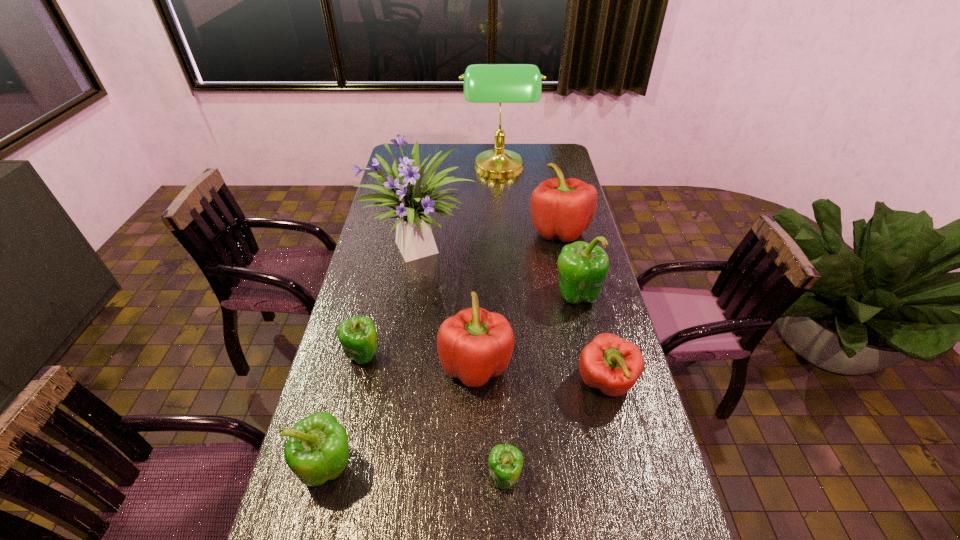
Select which bell pepper appears as the third closest to the second biggest pink bell pepper. Please provide its 2D coordinates. Your answer should be formatted as a tuple, i.e. [(x, y)], where the tuple contains the x and y coordinates of a point satisfying the conditions above.

[(583, 268)]

This screenshot has width=960, height=540. I want to click on the closest green bell pepper to the second smallest green bell pepper, so click(317, 450).

Identify which green bell pepper is the closest to the biggest green bell pepper. Please provide its 2D coordinates. Your answer should be formatted as a tuple, i.e. [(x, y)], where the tuple contains the x and y coordinates of a point satisfying the conditions above.

[(505, 462)]

You are a GUI agent. You are given a task and a screenshot of the screen. Output one action in this format:
    pyautogui.click(x=<x>, y=<y>)
    Task: Click on the pink bell pepper that is the closest to the green lamp
    The image size is (960, 540).
    Given the screenshot: What is the action you would take?
    pyautogui.click(x=560, y=208)

Identify which pink bell pepper is the nearest to the biggest pink bell pepper. Please provide its 2D coordinates. Your answer should be formatted as a tuple, i.e. [(x, y)], where the tuple contains the x and y coordinates of a point satisfying the conditions above.

[(475, 344)]

The height and width of the screenshot is (540, 960). I want to click on vacant space that satisfies the following two spatial constraints: 1. on the back side of the second biggest green bell pepper; 2. on the left side of the third biggest green bell pepper, so click(358, 355).

Image resolution: width=960 pixels, height=540 pixels. What are the coordinates of `vacant space that satisfies the following two spatial constraints: 1. on the back side of the second green bell pepper from right to left; 2. on the left side of the biggest pink bell pepper` in the screenshot? It's located at (494, 231).

Identify the location of free spot that satisfies the following two spatial constraints: 1. on the back side of the farthest green bell pepper; 2. on the desk next to the lamp. The height and width of the screenshot is (540, 960). (548, 170).